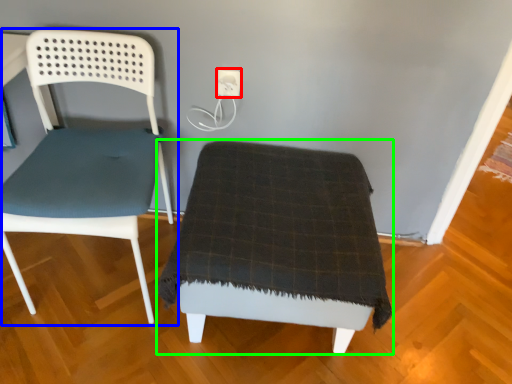
Question: Which object is the farthest from electric outlet (highlighted by a red box)? Choose among these: chair (highlighted by a blue box) or furniture (highlighted by a green box).

Choices:
 (A) chair
 (B) furniture

Answer: (B)